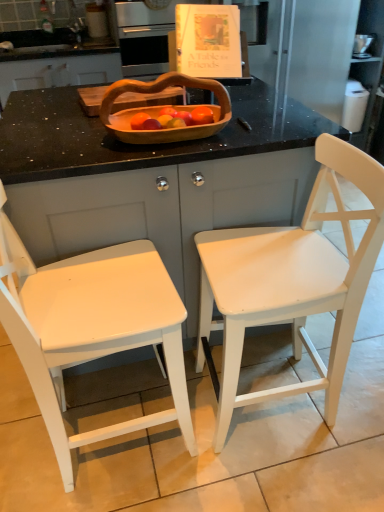
Find the location of `vacant area that lies to the right of wooden basket at center`. vacant area that lies to the right of wooden basket at center is located at coordinates (268, 129).